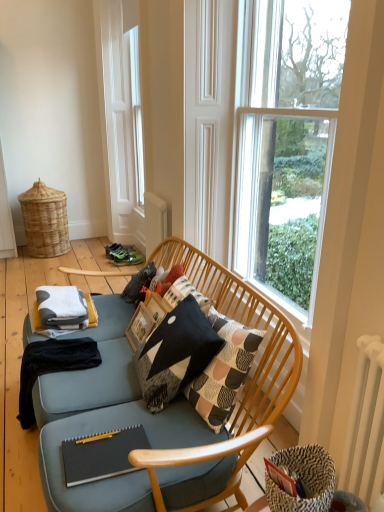
Find the location of a particular element. Image resolution: width=384 pixels, height=512 pixels. free point above black matte notebook at lower center (from a real-world perspective) is located at coordinates (96, 453).